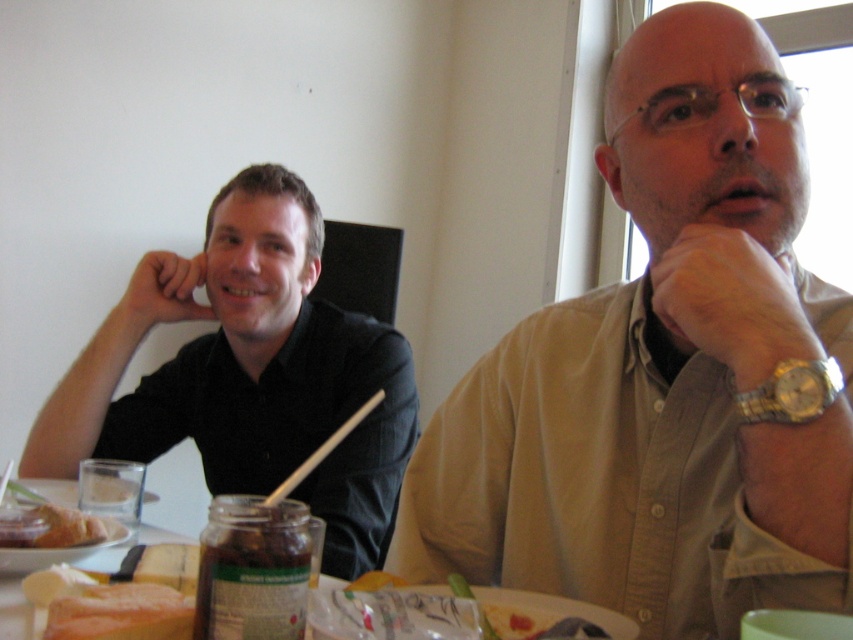
You are a photographer trying to capture a closeup of the white bread at lower left and the golden bread at lower left. Since both are at the lower left, which one should you focus on to ensure both are in frame without moving the camera?

The white bread at lower left occupies less space than golden bread at lower left, so focusing on the larger golden bread at lower left would ensure both fit in the frame as the smaller white bread at lower left would naturally be within the same area.

You are taking a photo of two people sitting at a table. You notice two points in the image labeled as point 1 and point 2. If point 1 is at coordinate (84,605) and point 2 is at (22,522), which point is closer to the camera?

Point 1 at coordinate (84,605) is closer to the camera than point 2 at (22,522).

You are a photographer using a camera that has a minimum focusing distance of 20 inches. You want to take a clear photo of the white bread at lower left. Can you do it without moving the camera?

The white bread at lower left and camera are 22.20 inches apart, which is within the minimum focusing distance of 20 inches. Therefore, you can take a clear photo of the white bread at lower left without moving the camera.